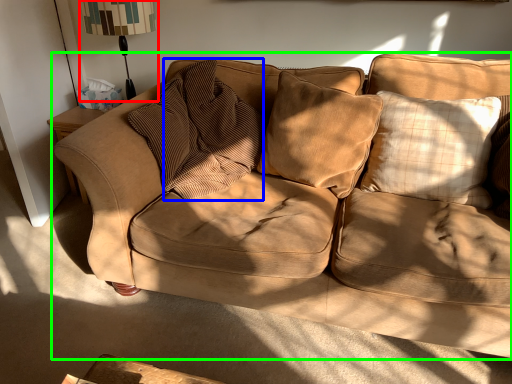
Question: Considering the real-world distances, which object is closest to table lamp (highlighted by a red box)? pillow (highlighted by a blue box) or studio couch (highlighted by a green box).

Choices:
 (A) pillow
 (B) studio couch

Answer: (A)